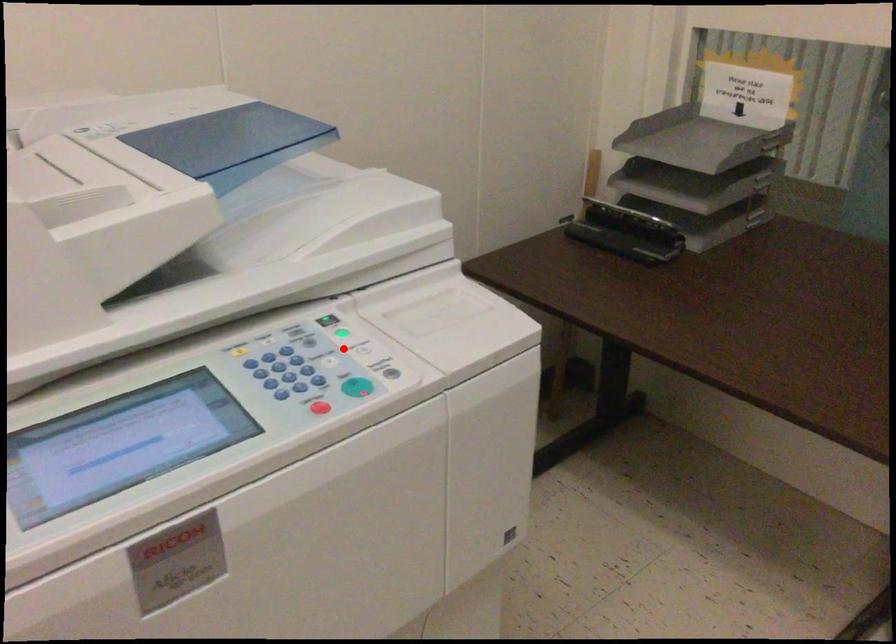
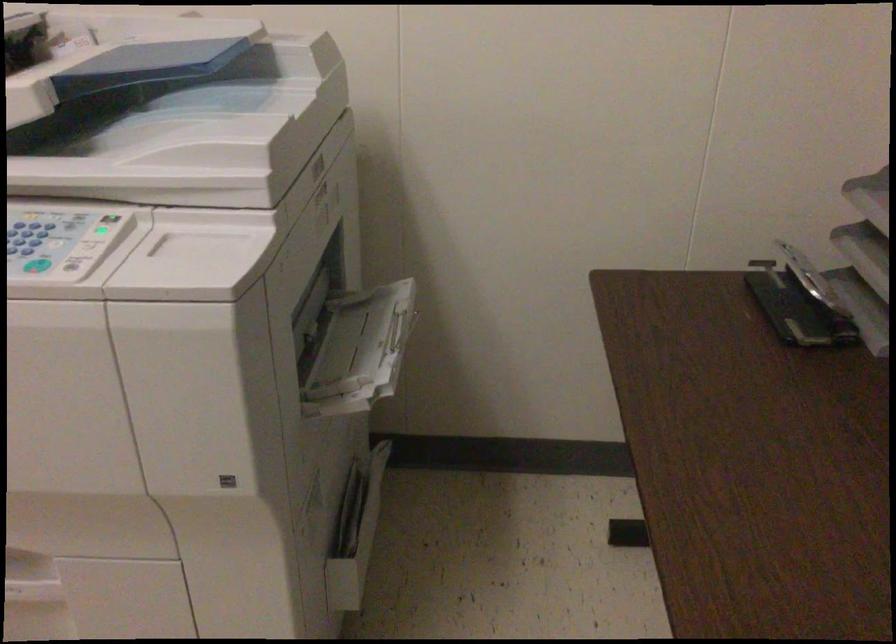
Question: I am providing you with two images of the same scene from different viewpoints. Given a red point in image1, look at the same physical point in image2. Is it:

Choices:
 (A) Closer to the viewpoint
 (B) Farther from the viewpoint

Answer: (B)